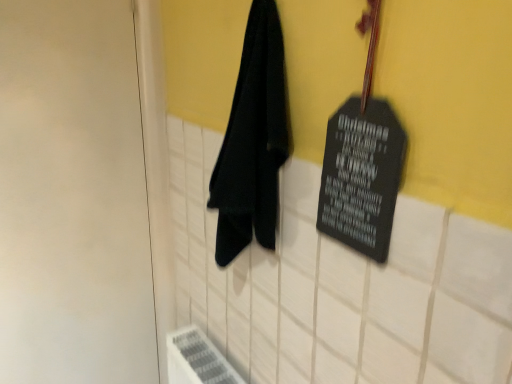
Question: Is white matte door at left positioned beyond the bounds of black fabric towel at center?

Choices:
 (A) no
 (B) yes

Answer: (B)

Question: Considering the relative sizes of white matte door at left and black fabric towel at center in the image provided, is white matte door at left bigger than black fabric towel at center?

Choices:
 (A) yes
 (B) no

Answer: (A)

Question: Considering the relative sizes of white matte door at left and black fabric towel at center in the image provided, is white matte door at left thinner than black fabric towel at center?

Choices:
 (A) yes
 (B) no

Answer: (A)

Question: Does white matte door at left have a smaller size compared to black fabric towel at center?

Choices:
 (A) no
 (B) yes

Answer: (A)

Question: Is white matte door at left turned away from black fabric towel at center?

Choices:
 (A) no
 (B) yes

Answer: (A)

Question: Is black fabric towel at center taller or shorter than black matte sign at upper right?

Choices:
 (A) tall
 (B) short

Answer: (A)

Question: From the image's perspective, is black fabric towel at center located above or below black matte sign at upper right?

Choices:
 (A) above
 (B) below

Answer: (B)

Question: Is black fabric towel at center inside or outside of black matte sign at upper right?

Choices:
 (A) outside
 (B) inside

Answer: (A)

Question: In terms of width, does black fabric towel at center look wider or thinner when compared to black matte sign at upper right?

Choices:
 (A) thin
 (B) wide

Answer: (B)

Question: Choose the correct answer: Is white matte door at left inside black fabric towel at center or outside it?

Choices:
 (A) outside
 (B) inside

Answer: (A)

Question: Visually, is white matte door at left positioned to the left or to the right of black fabric towel at center?

Choices:
 (A) left
 (B) right

Answer: (A)

Question: In terms of size, does white matte door at left appear bigger or smaller than black fabric towel at center?

Choices:
 (A) small
 (B) big

Answer: (B)

Question: In terms of width, does white matte door at left look wider or thinner when compared to black fabric towel at center?

Choices:
 (A) wide
 (B) thin

Answer: (B)

Question: From a real-world perspective, is white matte door at left physically located above or below black matte sign at upper right?

Choices:
 (A) below
 (B) above

Answer: (A)

Question: Is point (38, 46) closer or farther from the camera than point (389, 213)?

Choices:
 (A) farther
 (B) closer

Answer: (A)